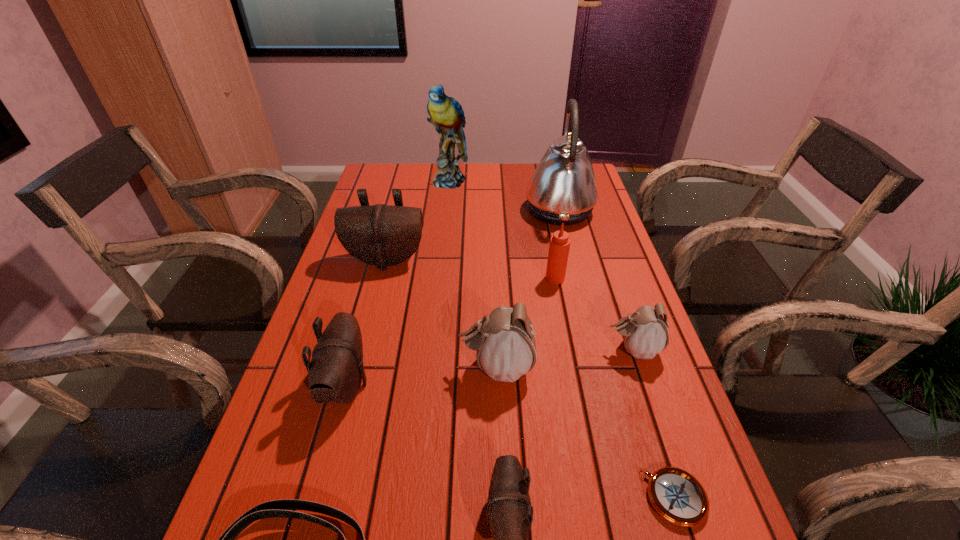
What are the coordinates of `parrot` in the screenshot? It's located at pyautogui.click(x=446, y=114).

This screenshot has height=540, width=960. What are the coordinates of `kettle` in the screenshot? It's located at (563, 189).

Locate an element on the screen. the farthest brown pouch is located at coordinates (382, 235).

I want to click on the farthest pouch, so click(x=382, y=235).

I want to click on the left white pouch, so click(x=505, y=343).

Locate an element on the screen. This screenshot has height=540, width=960. Tabasco sauce is located at coordinates (559, 246).

Image resolution: width=960 pixels, height=540 pixels. I want to click on the second smallest brown pouch, so click(336, 371).

Where is `the right white pouch`? The width and height of the screenshot is (960, 540). the right white pouch is located at coordinates [645, 334].

Image resolution: width=960 pixels, height=540 pixels. Identify the location of the rightmost pouch. (645, 334).

At what (x,y) coordinates should I click in order to perform the action: click on the shortest object. Please return your answer as a coordinate pair (x, y). The height and width of the screenshot is (540, 960). Looking at the image, I should click on (677, 496).